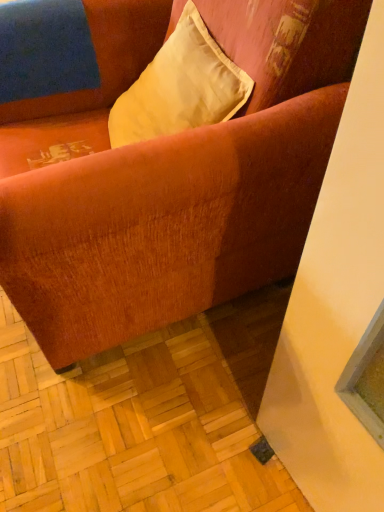
Question: From the image's perspective, does satin yellow pillow at upper center appear lower than velvet orange couch at center?

Choices:
 (A) no
 (B) yes

Answer: (A)

Question: Does satin yellow pillow at upper center have a smaller size compared to velvet orange couch at center?

Choices:
 (A) no
 (B) yes

Answer: (B)

Question: Considering the relative sizes of satin yellow pillow at upper center and velvet orange couch at center in the image provided, is satin yellow pillow at upper center bigger than velvet orange couch at center?

Choices:
 (A) no
 (B) yes

Answer: (A)

Question: Is there a large distance between satin yellow pillow at upper center and velvet orange couch at center?

Choices:
 (A) no
 (B) yes

Answer: (A)

Question: Is satin yellow pillow at upper center turned away from velvet orange couch at center?

Choices:
 (A) no
 (B) yes

Answer: (B)

Question: Can you confirm if satin yellow pillow at upper center is taller than velvet orange couch at center?

Choices:
 (A) yes
 (B) no

Answer: (B)

Question: Can you confirm if velvet orange couch at center is shorter than satin yellow pillow at upper center?

Choices:
 (A) no
 (B) yes

Answer: (A)

Question: Would you say velvet orange couch at center is a long distance from satin yellow pillow at upper center?

Choices:
 (A) no
 (B) yes

Answer: (A)

Question: Is velvet orange couch at center directly adjacent to satin yellow pillow at upper center?

Choices:
 (A) no
 (B) yes

Answer: (A)

Question: From a real-world perspective, is velvet orange couch at center located beneath satin yellow pillow at upper center?

Choices:
 (A) no
 (B) yes

Answer: (B)

Question: Is velvet orange couch at center positioned before satin yellow pillow at upper center?

Choices:
 (A) yes
 (B) no

Answer: (A)

Question: Does velvet orange couch at center appear on the right side of satin yellow pillow at upper center?

Choices:
 (A) no
 (B) yes

Answer: (A)

Question: In the image, is velvet orange couch at center on the left side or the right side of satin yellow pillow at upper center?

Choices:
 (A) left
 (B) right

Answer: (A)